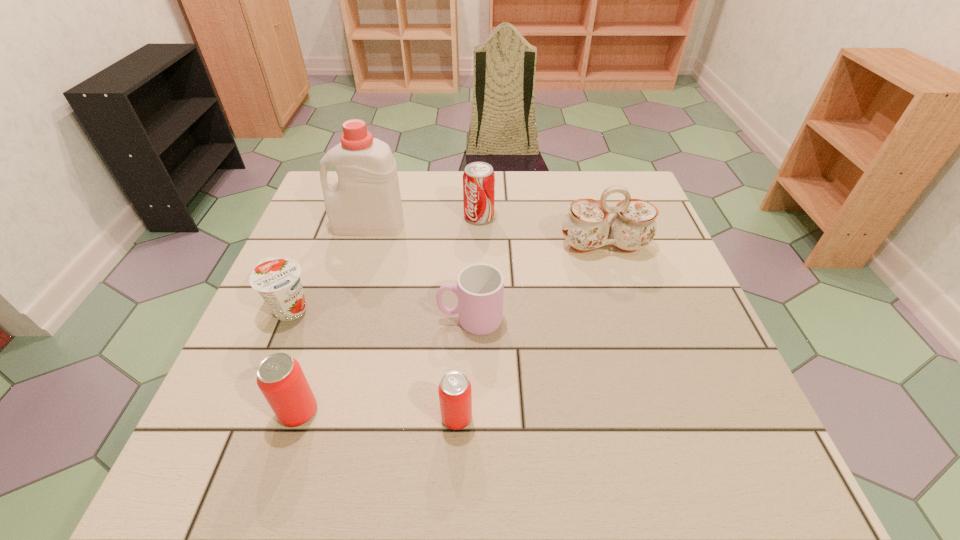
Where is `object that is at the right edge`? This screenshot has height=540, width=960. object that is at the right edge is located at coordinates (586, 226).

You are a GUI agent. You are given a task and a screenshot of the screen. Output one action in this format:
    pyautogui.click(x=<x>, y=<y>)
    Task: Click on the object located at the far left corner
    This screenshot has width=960, height=540.
    Given the screenshot: What is the action you would take?
    pyautogui.click(x=366, y=201)

Find the location of a particular element. object at the near left corner is located at coordinates (280, 378).

Identify the location of free space at the far edge of the desktop. (420, 197).

In the image, there is a desktop. Identify the location of free region at the near edge. (550, 390).

You are a GUI agent. You are given a task and a screenshot of the screen. Output one action in this format:
    pyautogui.click(x=<x>, y=<y>)
    Task: Click on the vacant space at the left edge of the desktop
    The width and height of the screenshot is (960, 540).
    Given the screenshot: What is the action you would take?
    pyautogui.click(x=267, y=308)

Locate an element on the screen. This screenshot has width=960, height=540. vacant space at the right edge of the desktop is located at coordinates (667, 268).

The image size is (960, 540). I want to click on vacant area at the far right corner of the desktop, so [585, 178].

This screenshot has width=960, height=540. I want to click on vacant area that lies between the taller beer can and the right beer can, so click(378, 415).

In order to click on empty space that is in between the left beer can and the chinaware in this screenshot , I will do `click(451, 329)`.